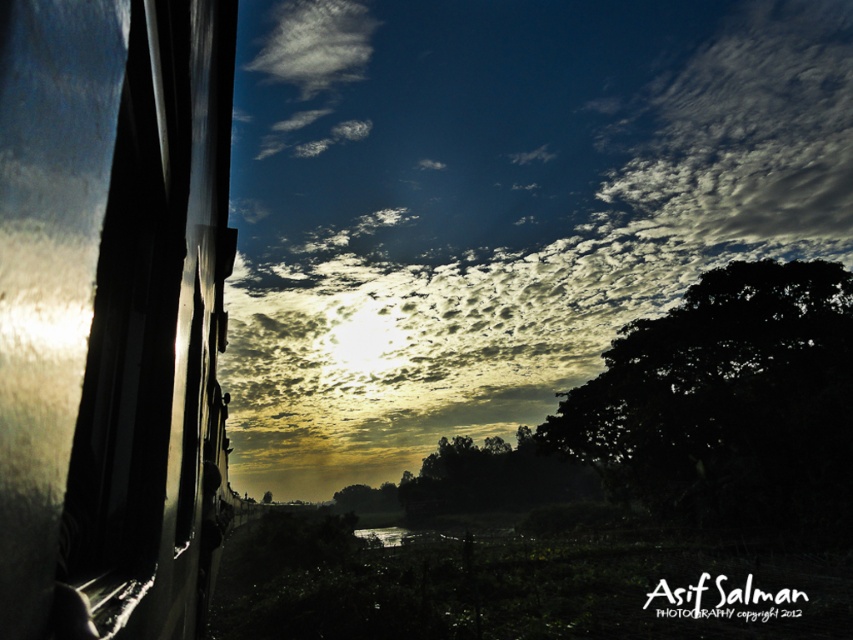
You are sitting by the window on the train and notice two points marked in the scene. Which point is nearer to you, the one at coordinates point (x=77, y=96) or the one at point (x=799, y=465)?

Point (x=77, y=96) is closer to the viewer than point (x=799, y=465).

You are sitting by the window on a train and see the cloudy sky at upper center and the dark green leafy tree at right outside. Which object occupies more space in your view?

The cloudy sky at upper center occupies more space in your view because it is larger in size than the dark green leafy tree at right.

You are sitting in the train and looking out the window. You notice two points marked on the window at coordinates point (761,44) and point (732,289). Which point is closer to your eyes?

Point (732,289) is closer to your eyes because it is less further to the camera than point (761,44).